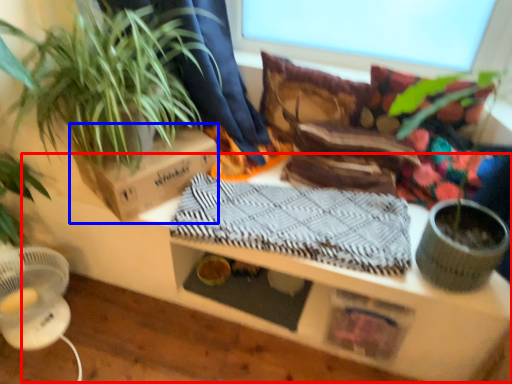
Question: Which of the following is the farthest to the observer, table (highlighted by a red box) or cardboard box (highlighted by a blue box)?

Choices:
 (A) table
 (B) cardboard box

Answer: (B)